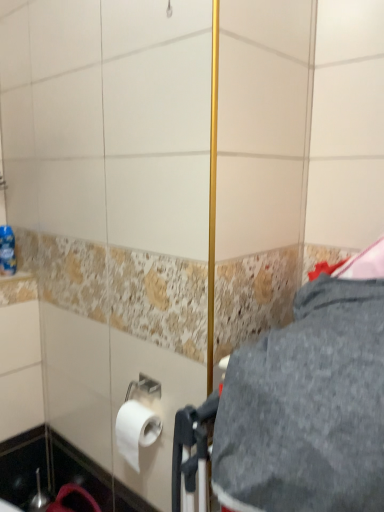
Question: Considering their positions, is gray fabric at center located in front of or behind white matte toilet paper at lower left?

Choices:
 (A) behind
 (B) front

Answer: (B)

Question: Considering the positions of gray fabric at center and white matte toilet paper at lower left in the image, is gray fabric at center taller or shorter than white matte toilet paper at lower left?

Choices:
 (A) short
 (B) tall

Answer: (B)

Question: Which of these objects is positioned closest to the gray fabric at center?

Choices:
 (A) white matte toilet paper at lower left
 (B) blue plastic bottle at left

Answer: (A)

Question: Which is farther from the white matte toilet paper at lower left?

Choices:
 (A) gray fabric at center
 (B) blue plastic bottle at left

Answer: (B)